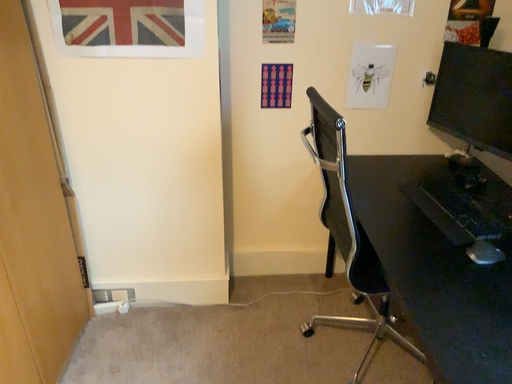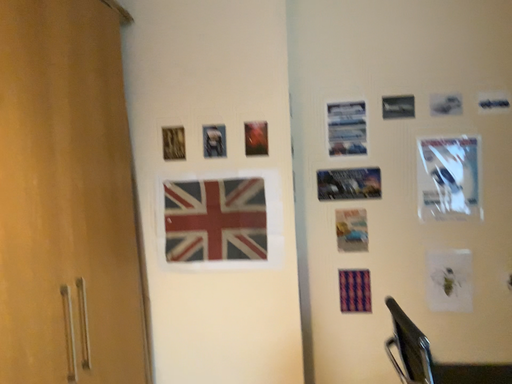
Question: Which way did the camera rotate in the video?

Choices:
 (A) rotated upward
 (B) rotated downward

Answer: (A)